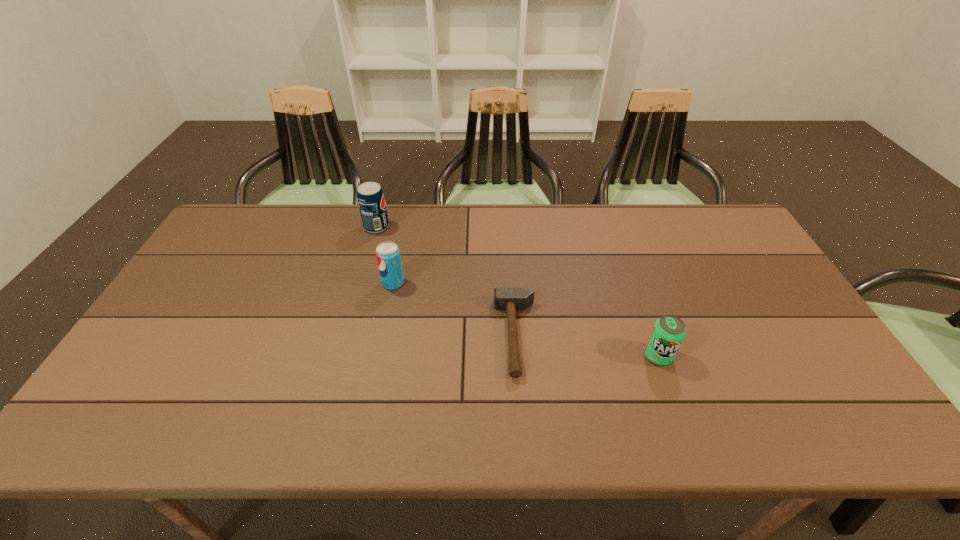
Image resolution: width=960 pixels, height=540 pixels. I want to click on vacant space that's between the second farthest object and the third object from left to right, so click(x=455, y=309).

Identify the location of vacant space that is in between the rightmost pop soda and the third object from left to right. This screenshot has width=960, height=540. (588, 346).

Image resolution: width=960 pixels, height=540 pixels. I want to click on vacant region between the second farthest object and the hammer, so click(455, 309).

I want to click on free spot between the second pop soda from left to right and the shortest object, so click(x=455, y=309).

Select which object appears as the closest to the second object from left to right. Please provide its 2D coordinates. Your answer should be formatted as a tuple, i.e. [(x, y)], where the tuple contains the x and y coordinates of a point satisfying the conditions above.

[(370, 196)]

Identify the location of the third closest object to the leftmost object. (668, 332).

Point out which pop soda is positioned as the nearest to the nearest pop soda. Please provide its 2D coordinates. Your answer should be formatted as a tuple, i.e. [(x, y)], where the tuple contains the x and y coordinates of a point satisfying the conditions above.

[(388, 257)]

Locate which pop soda ranks second in proximity to the farthest object. Please provide its 2D coordinates. Your answer should be formatted as a tuple, i.e. [(x, y)], where the tuple contains the x and y coordinates of a point satisfying the conditions above.

[(668, 332)]